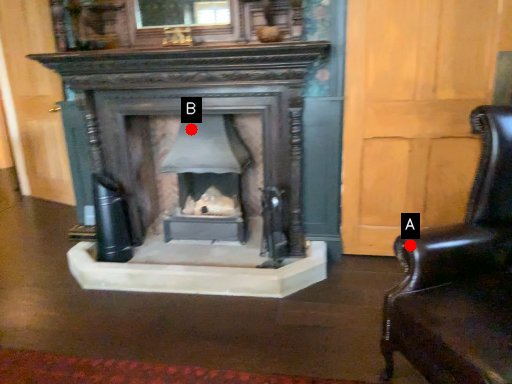
Question: Two points are circled on the image, labeled by A and B beside each circle. Which point is further to the camera?

Choices:
 (A) A is further
 (B) B is further

Answer: (B)